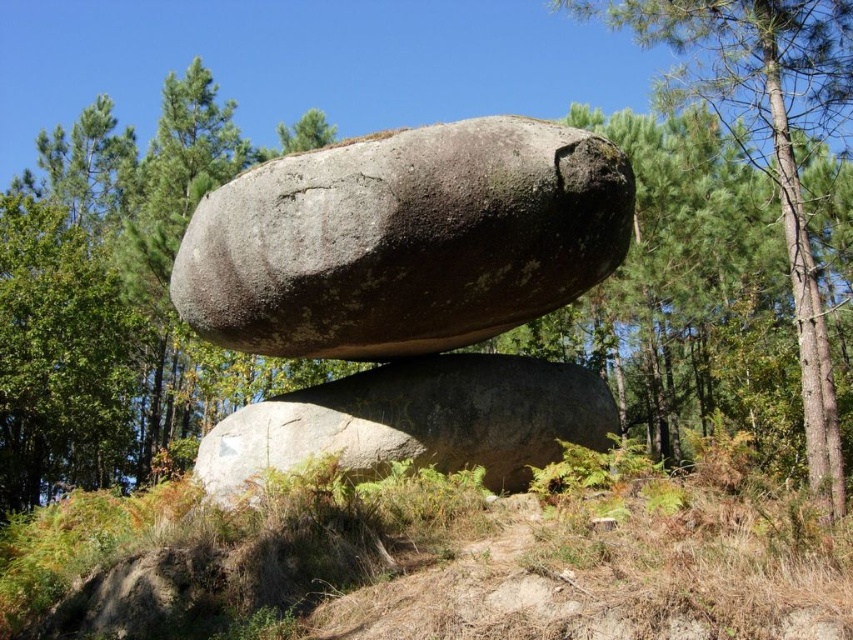
You are standing at the origin point in the image. Can you tell me the exact 2D coordinates of the gray rough rock at center?

The gray rough rock at center is located at coordinates (404, 241).

You are a geologist analyzing the image. You need to locate the gray rough boulder at center. What are its coordinates in the image?

The gray rough boulder at center is located at coordinates (416, 420).

You are a photographer planning to capture the gray rough rock at center and the green leafy tree at upper right in a single frame. Based on their sizes, which object should you focus on first to ensure both are clearly visible in the photo?

The gray rough rock at center has a larger size compared to the green leafy tree at upper right, so you should focus on the gray rough rock at center first to ensure both are clearly visible in the photo.